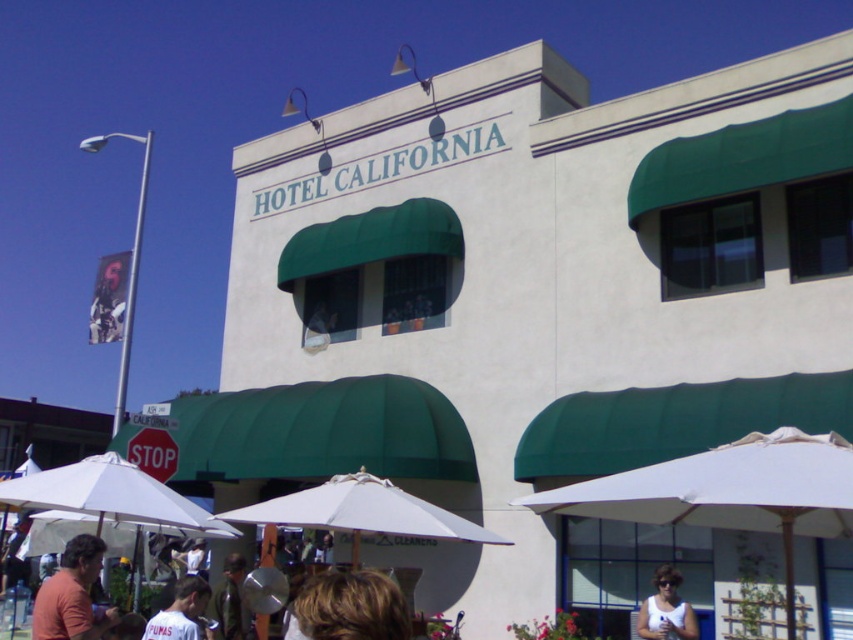
Who is shorter, white fabric umbrella at center or orange t-shirt at lower left?

white fabric umbrella at center

Who is more distant from viewer, (367, 481) or (49, 628)?

The point (367, 481) is more distant.

The image size is (853, 640). Identify the location of white fabric umbrella at center. coord(363,513).

Is white fabric umbrella at lower left positioned before blonde hair at lower center?

No.

Which is behind, point (115, 456) or point (306, 582)?

Point (306, 582)

The width and height of the screenshot is (853, 640). I want to click on white fabric umbrella at lower left, so click(109, 496).

Between point (80, 472) and point (138, 433), which one is positioned in front?

Positioned in front is point (80, 472).

Between point (3, 497) and point (144, 432), which one is positioned behind?

The point (144, 432) is behind.

I want to click on white fabric umbrella at lower left, so click(109, 496).